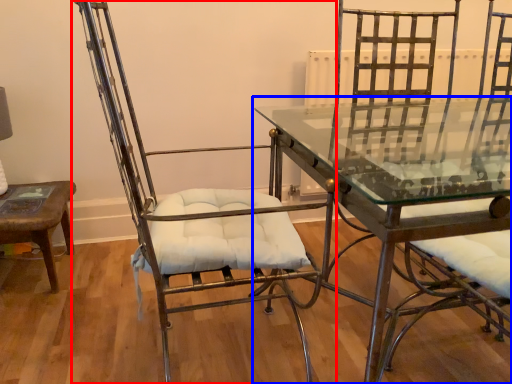
Question: Which point is further to the camera, chair (highlighted by a red box) or table (highlighted by a blue box)?

Choices:
 (A) chair
 (B) table

Answer: (A)